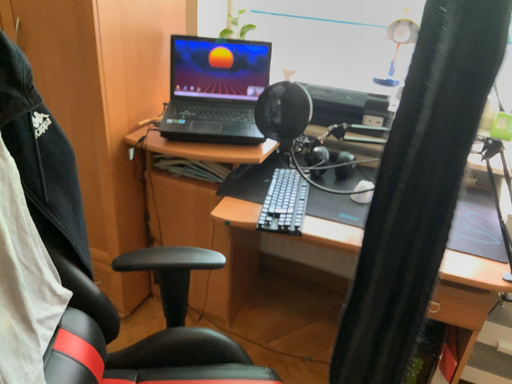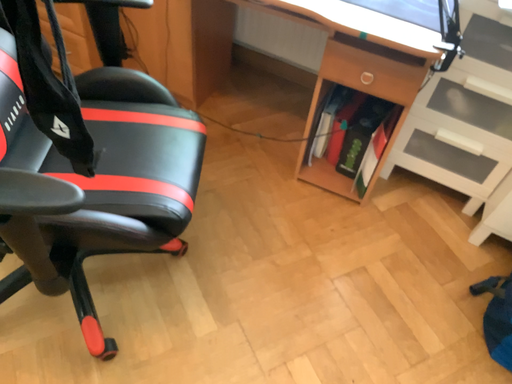
Question: Which way did the camera rotate in the video?

Choices:
 (A) rotated downward
 (B) rotated upward

Answer: (A)